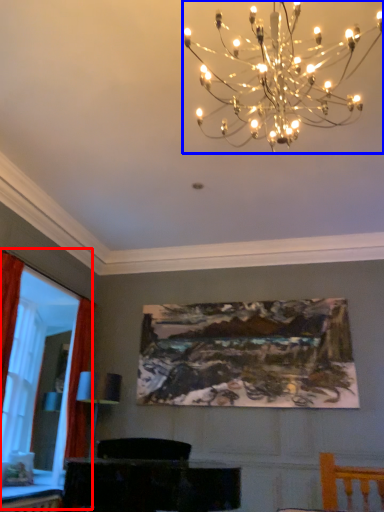
Question: Among these objects, which one is farthest to the camera, bay window (highlighted by a red box) or lamp (highlighted by a blue box)?

Choices:
 (A) bay window
 (B) lamp

Answer: (A)